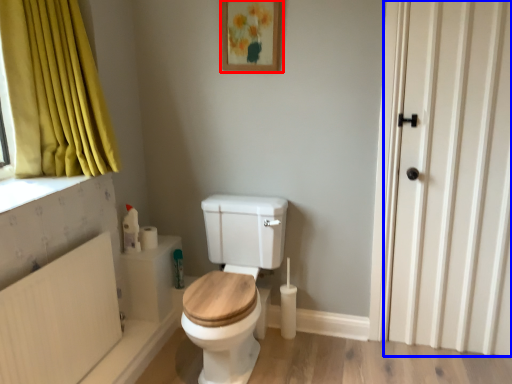
Question: Among these objects, which one is nearest to the camera, picture frame (highlighted by a red box) or door (highlighted by a blue box)?

Choices:
 (A) picture frame
 (B) door

Answer: (B)